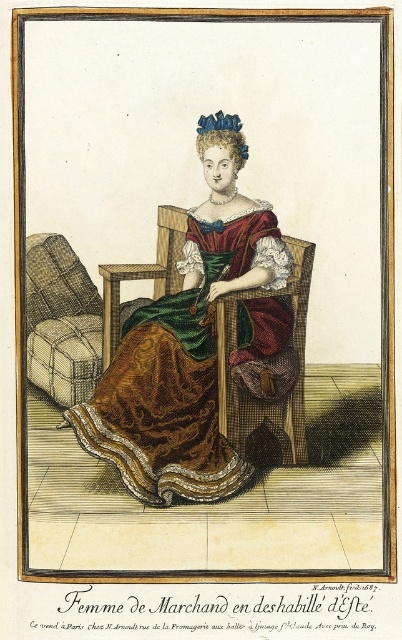
You are an interior designer observing this historical engraving. You need to place a small decorative pillow between the brown satin dress at center and the plaid fabric armchair at left. Based on their positions, which object should the pillow be closer to?

The brown satin dress at center is to the right of the plaid fabric armchair at left. Therefore, the pillow should be placed closer to the plaid fabric armchair at left since the dress is positioned to its right, creating space between them.

You are an interior designer assessing the proportions of the room in the image. The room has limited space. You see the brown satin dress at center and the plaid fabric armchair at left. Which object occupies more space in the room?

The brown satin dress at center has a larger size compared to the plaid fabric armchair at left, so it occupies more space in the room.

You are an interior designer assessing the proportions of furniture and clothing in this historical engraving. The scene shows a woman wearing a brown satin dress at center seated on a plaid fabric armchair at left. Based on the image, which object occupies a greater vertical space in the composition?

The brown satin dress at center is much taller as plaid fabric armchair at left, meaning the dress takes up more vertical space in the engraving.